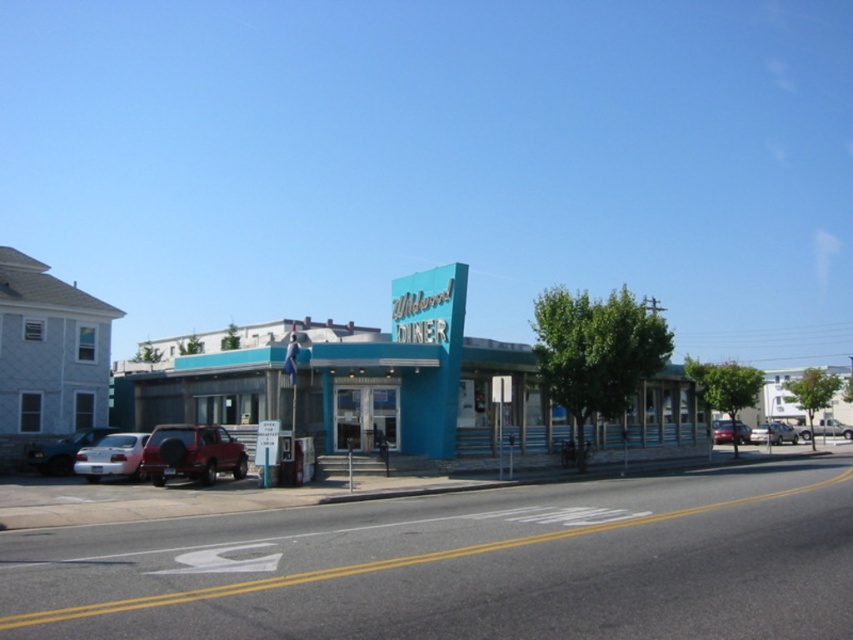
Can you confirm if metallic silver sedan at center is smaller than metallic red car at center?

Yes, metallic silver sedan at center is smaller than metallic red car at center.

Is metallic silver sedan at center taller than metallic red car at center?

Incorrect, metallic silver sedan at center's height is not larger of metallic red car at center's.

The height and width of the screenshot is (640, 853). I want to click on metallic silver sedan at center, so click(772, 433).

The width and height of the screenshot is (853, 640). I want to click on metallic silver sedan at center, so click(x=772, y=433).

Who is positioned more to the left, matte silver suv at left or metallic red car at center?

A: Positioned to the left is matte silver suv at left.

Between point (33, 458) and point (729, 420), which one is positioned in front?

Point (33, 458) is in front.

Where is `matte silver suv at left`? This screenshot has width=853, height=640. matte silver suv at left is located at coordinates (62, 451).

Can you confirm if metallic silver sedan at center is taller than metallic silver truck at center?

No, metallic silver sedan at center is not taller than metallic silver truck at center.

Can you confirm if metallic silver sedan at center is positioned above metallic silver truck at center?

Correct, metallic silver sedan at center is located above metallic silver truck at center.

Find the location of a particular element. Image resolution: width=853 pixels, height=640 pixels. metallic silver sedan at center is located at coordinates (772, 433).